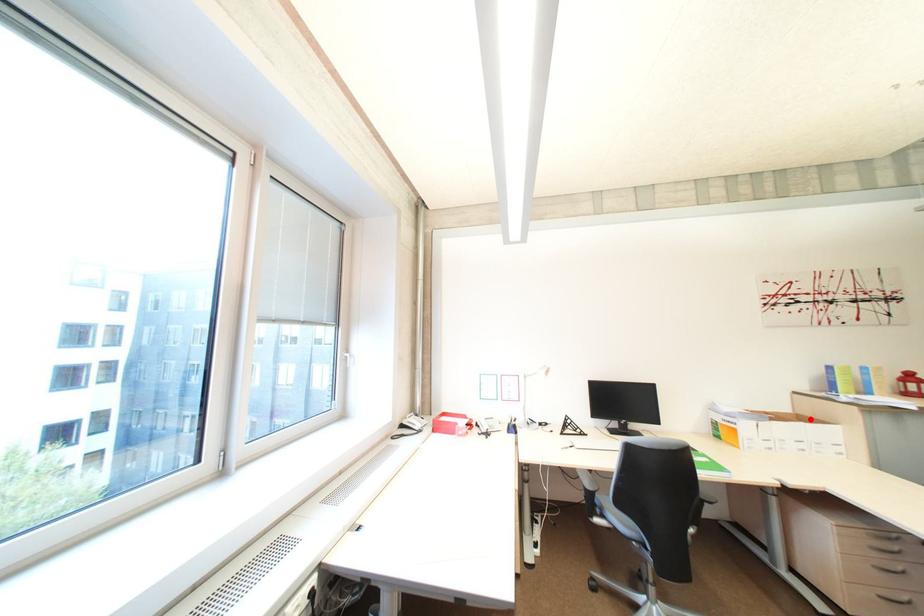
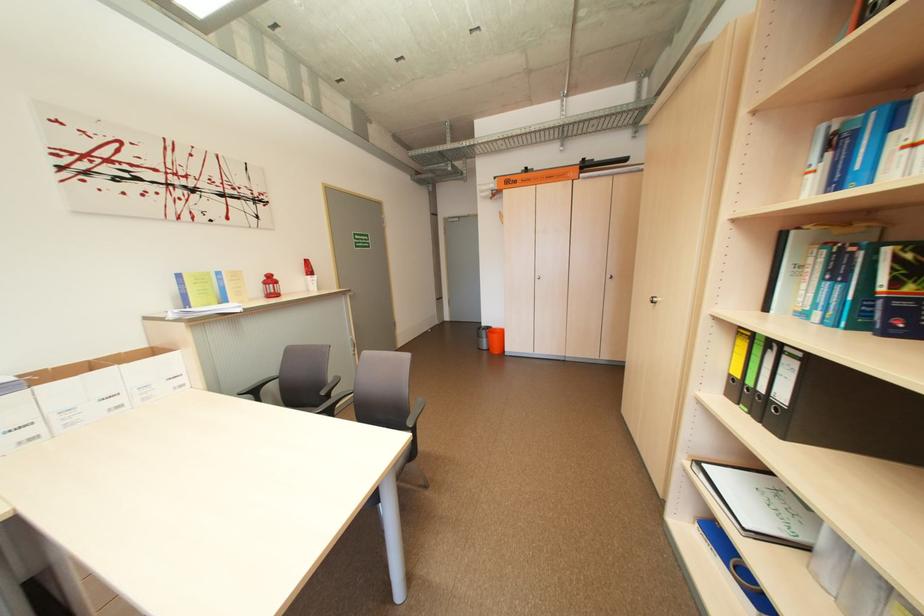
In the second image, find the point that corresponds to the highlighted location in the first image.

(163, 353)